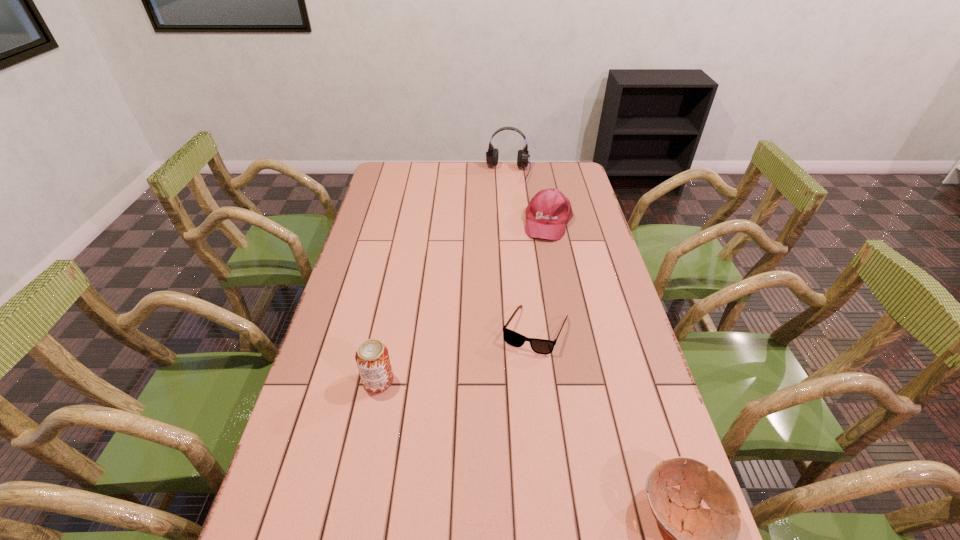
Find the location of a particular element. The image size is (960, 540). free location that satisfies the following two spatial constraints: 1. on the back side of the sunglasses; 2. on the left side of the fourth farthest object is located at coordinates (389, 330).